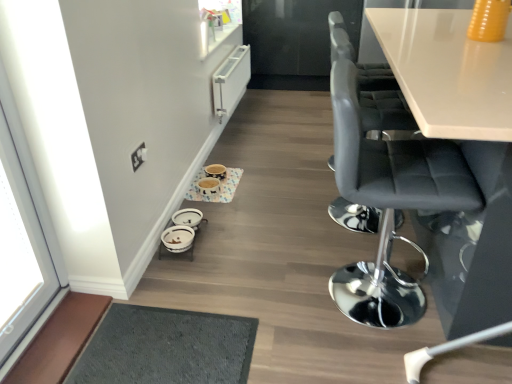
You are a GUI agent. You are given a task and a screenshot of the screen. Output one action in this format:
    pyautogui.click(x=<x>, y=<y>)
    Task: Click on the free area in between black leather stool at right, the second chair positioned from the back, and gray fabric chair at right, the 2th chair viewed from the front
    Image resolution: width=512 pixels, height=384 pixels.
    Given the screenshot: What is the action you would take?
    pyautogui.click(x=368, y=242)